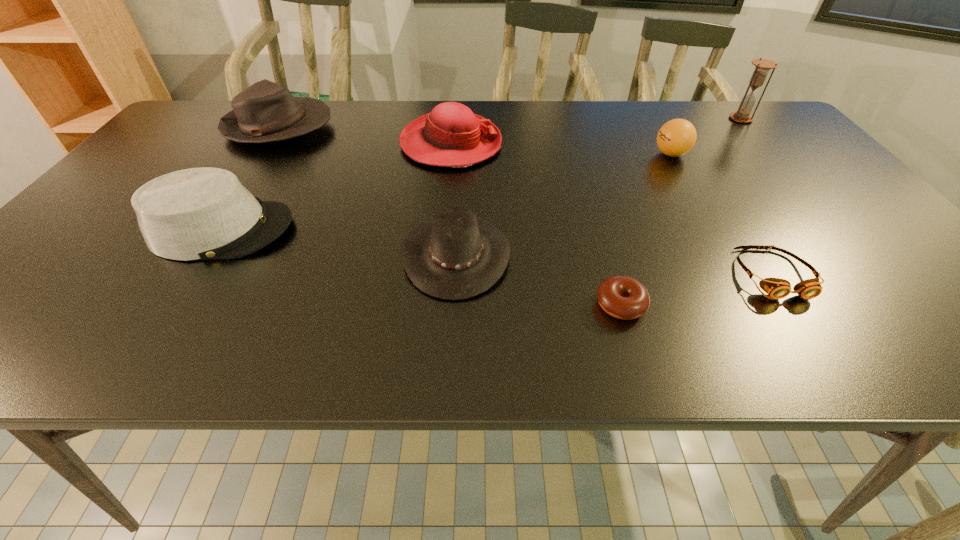
Select which object is the seventh closest to the fifth object from left to right. Please provide its 2D coordinates. Your answer should be formatted as a tuple, i.e. [(x, y)], where the tuple contains the x and y coordinates of a point satisfying the conditions above.

[(265, 112)]

In order to click on the third closest hat to the shortest hat in this screenshot , I will do `click(265, 112)`.

Where is `hat that can be found as the second closest to the goggles`? The height and width of the screenshot is (540, 960). hat that can be found as the second closest to the goggles is located at coordinates (451, 135).